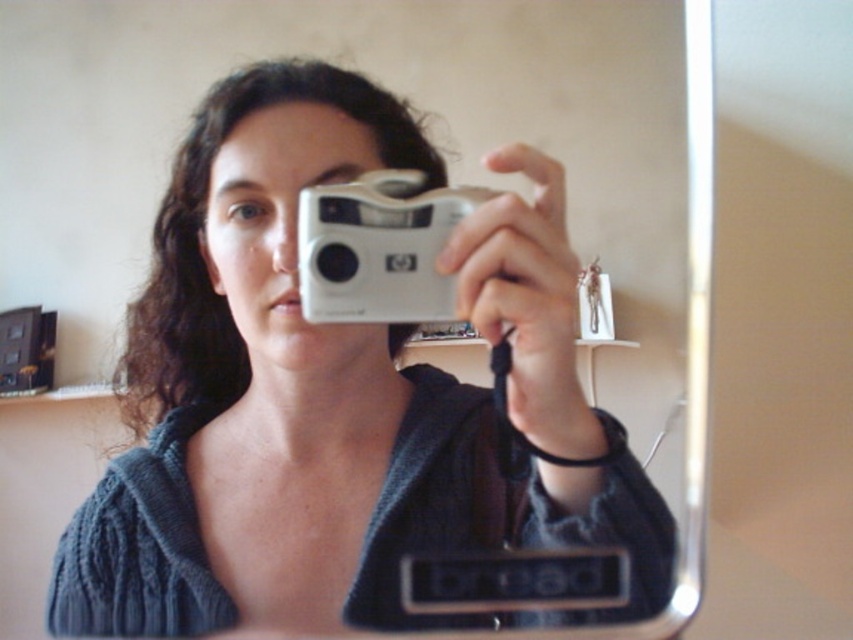
You are a photographer trying to take a selfie with a matte silver camera at center. To ensure the best focus, you need to be at least 12 inches away from the camera. Based on the scene, are you within the minimum focusing distance?

The matte silver camera at center and viewer are 12.76 inches apart from each other, so you are within the minimum focusing distance since 12.76 inches is just over 12 inches.

You are a photographer trying to choose between two cameras for a photo shoot. You notice the matte silver camera at center and the silver metallic camera at center in the scene. Which camera is taller?

The matte silver camera at center is taller than the silver metallic camera at center.